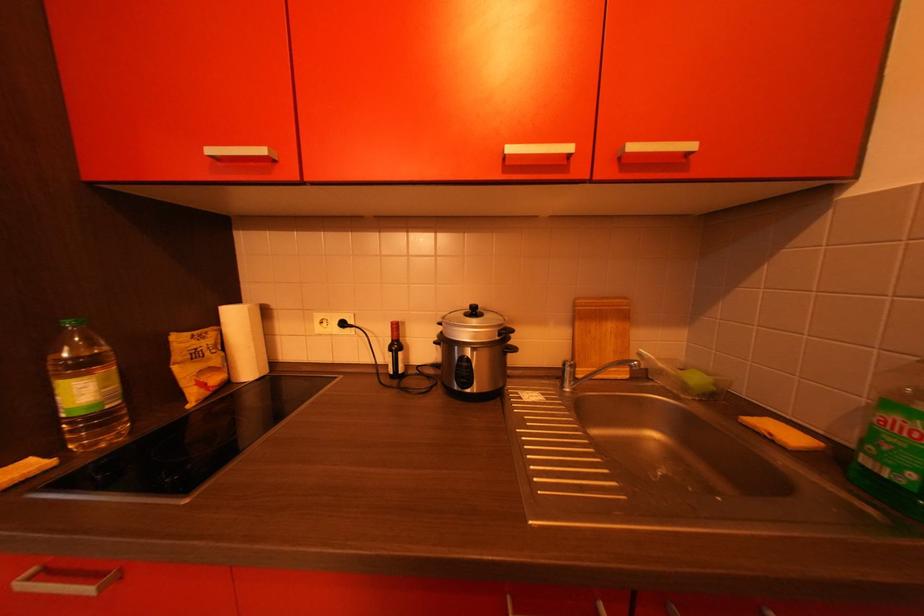
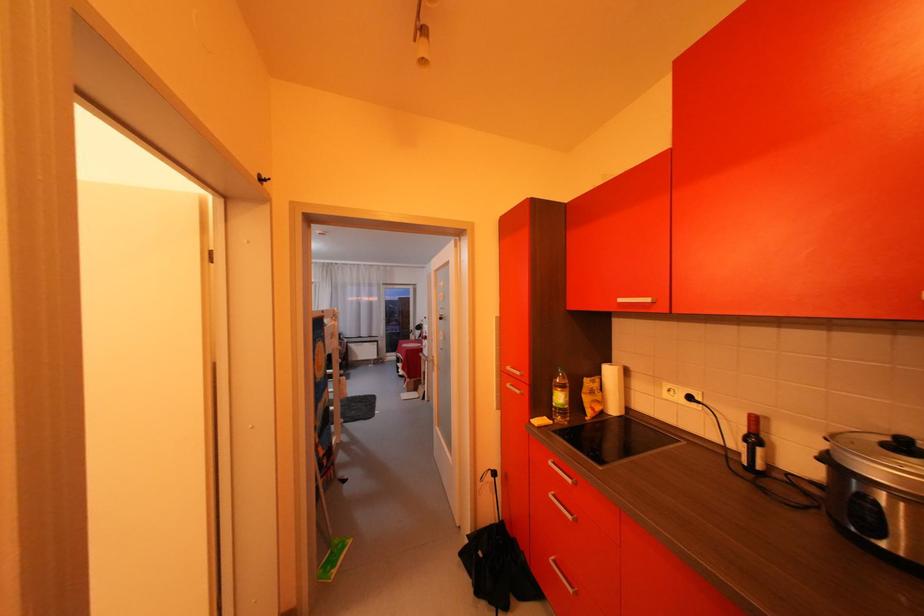
In the second image, find the point that corresponds to [223,153] in the first image.

(631, 302)